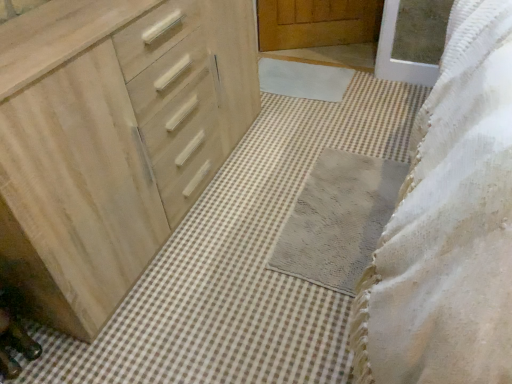
Question: Which direction should I rotate to look at white soft bath mat at center, marked as the first bath mat in a back-to-front arrangement, — up or down?

Choices:
 (A) up
 (B) down

Answer: (A)

Question: From a real-world perspective, is natural wood chest of drawers at left located higher than white soft bath mat at center, marked as the first bath mat in a back-to-front arrangement?

Choices:
 (A) yes
 (B) no

Answer: (A)

Question: Does natural wood chest of drawers at left appear on the left side of white soft bath mat at center, arranged as the second bath mat when ordered from the bottom?

Choices:
 (A) no
 (B) yes

Answer: (B)

Question: From a real-world perspective, is natural wood chest of drawers at left under white soft bath mat at center, arranged as the second bath mat when ordered from the bottom?

Choices:
 (A) yes
 (B) no

Answer: (B)

Question: Is white soft bath mat at center, arranged as the second bath mat when ordered from the bottom, located within natural wood chest of drawers at left?

Choices:
 (A) no
 (B) yes

Answer: (A)

Question: Is natural wood chest of drawers at left positioned beyond the bounds of white soft bath mat at center, marked as the 2th bath mat in a front-to-back arrangement?

Choices:
 (A) no
 (B) yes

Answer: (B)

Question: From the image's perspective, is natural wood chest of drawers at left beneath white soft bath mat at center, arranged as the second bath mat when ordered from the bottom?

Choices:
 (A) yes
 (B) no

Answer: (A)

Question: From a real-world perspective, is gray textured bath mat at center, the 1th bath mat when ordered from bottom to top, below white soft bath mat at center, marked as the 2th bath mat in a front-to-back arrangement?

Choices:
 (A) yes
 (B) no

Answer: (A)

Question: Is gray textured bath mat at center, the 1th bath mat when ordered from bottom to top, surrounding white soft bath mat at center, arranged as the second bath mat when ordered from the bottom?

Choices:
 (A) no
 (B) yes

Answer: (A)

Question: Can you confirm if gray textured bath mat at center, the 1th bath mat from the front, is shorter than white soft bath mat at center, arranged as the second bath mat when ordered from the bottom?

Choices:
 (A) no
 (B) yes

Answer: (B)

Question: Is gray textured bath mat at center, the 1th bath mat from the front, facing towards white soft bath mat at center, marked as the first bath mat in a back-to-front arrangement?

Choices:
 (A) no
 (B) yes

Answer: (A)

Question: Is the depth of gray textured bath mat at center, the 2th bath mat positioned from the back, greater than that of white soft bath mat at center, arranged as the 1th bath mat when viewed from the top?

Choices:
 (A) yes
 (B) no

Answer: (B)

Question: Is gray textured bath mat at center, the 2th bath mat positioned from the back, placed right next to white soft bath mat at center, arranged as the second bath mat when ordered from the bottom?

Choices:
 (A) no
 (B) yes

Answer: (A)

Question: From the image's perspective, is white soft bath mat at center, arranged as the second bath mat when ordered from the bottom, beneath gray textured bath mat at center, the 1th bath mat when ordered from bottom to top?

Choices:
 (A) yes
 (B) no

Answer: (B)